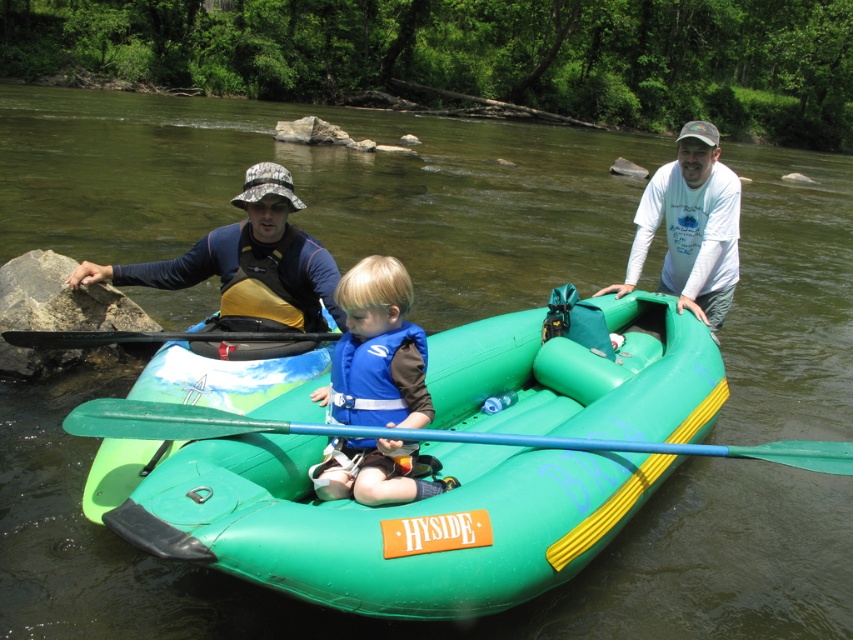
Who is more distant from viewer, (x=224, y=481) or (x=161, y=422)?

The point (x=161, y=422) is behind.

Locate an element on the screen. The width and height of the screenshot is (853, 640). green rubber raft at center is located at coordinates (375, 520).

Find the location of a particular element. The height and width of the screenshot is (640, 853). green rubber raft at center is located at coordinates (375, 520).

Does white long-sleeved shirt at upper right have a larger size compared to green plastic paddle at center?

Indeed, white long-sleeved shirt at upper right has a larger size compared to green plastic paddle at center.

Can you confirm if white long-sleeved shirt at upper right is smaller than green plastic paddle at center?

Actually, white long-sleeved shirt at upper right might be larger than green plastic paddle at center.

Measure the distance between point [711,180] and camera.

They are 19.11 feet apart.

You are a GUI agent. You are given a task and a screenshot of the screen. Output one action in this format:
    pyautogui.click(x=<x>, y=<y>)
    Task: Click on the white long-sleeved shirt at upper right
    This screenshot has height=640, width=853.
    Given the screenshot: What is the action you would take?
    pyautogui.click(x=689, y=227)

Which is more to the right, white long-sleeved shirt at upper right or black rubber paddle at left?

Positioned to the right is white long-sleeved shirt at upper right.

Is white long-sleeved shirt at upper right bigger than black rubber paddle at left?

Yes.

Does point (708, 193) come closer to viewer compared to point (109, 337)?

No, (708, 193) is behind (109, 337).

At what (x,y) coordinates should I click in order to perform the action: click on white long-sleeved shirt at upper right. Please return your answer as a coordinate pair (x, y). This screenshot has height=640, width=853. Looking at the image, I should click on (689, 227).